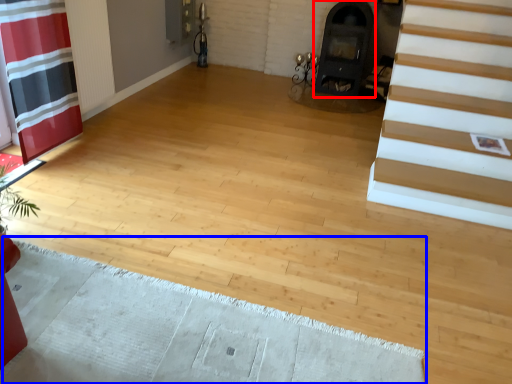
Question: Which of the following is the closest to the observer, fireplace (highlighted by a red box) or doormat (highlighted by a blue box)?

Choices:
 (A) fireplace
 (B) doormat

Answer: (B)